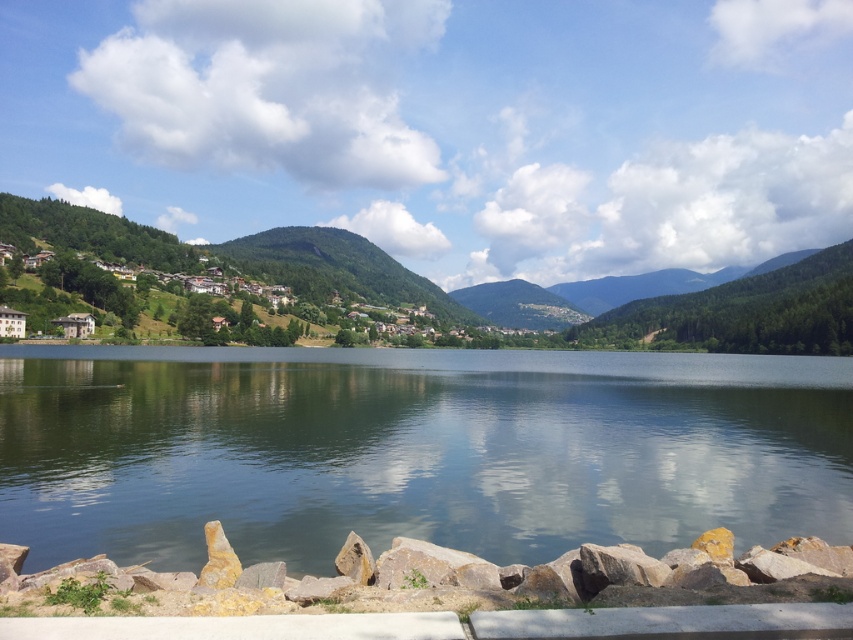
You are a photographer planning to capture the entire scene in one shot. Given that the smooth water at center and the green forested mountain at left are both in view, which object will occupy more of the horizontal space in your photo?

The green forested mountain at left will occupy more horizontal space in the photo since it has a greater width than the smooth water at center.

You are standing at the lakeside and want to take a photo that includes both the smooth water at center and the green forested mountain at left. Which object should you position closer to the edge of the frame to ensure both are visible?

To ensure both the smooth water at center and the green forested mountain at left are visible in your photo, position the green forested mountain at left closer to the edge of the frame since it is taller than the smooth water at center.